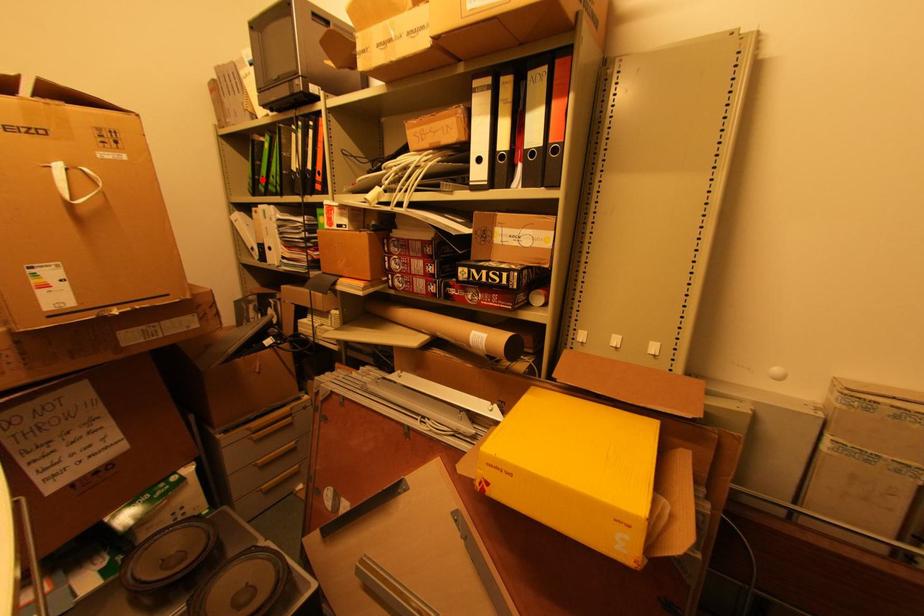
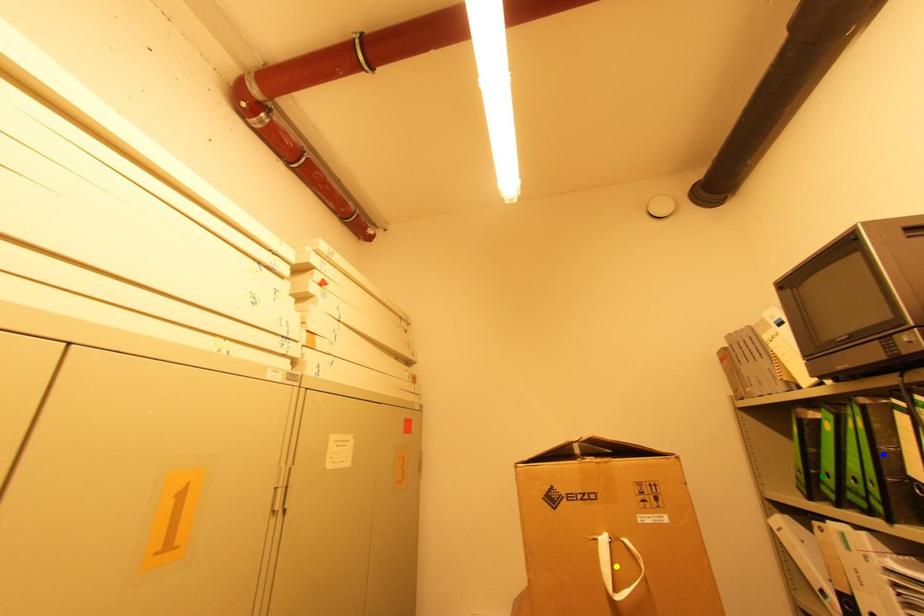
Question: I am providing you with two images of the same scene from different viewpoints. A red point is marked on the first image. You are given multiple points on the second image. Which point in image 2 is actually the same real-world point as the red point in image 1?

Choices:
 (A) yellow point
 (B) blue point
 (C) green point

Answer: (C)